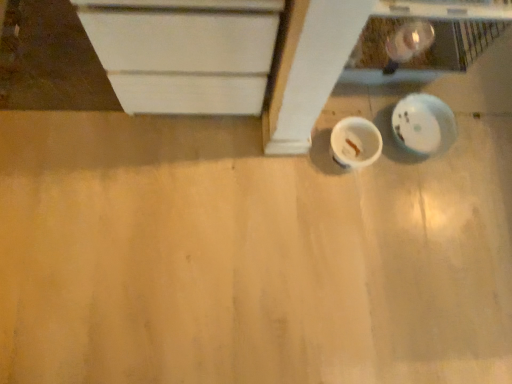
Question: Should I look upward or downward to see white glossy plate at lower right?

Choices:
 (A) up
 (B) down

Answer: (A)

Question: From the image's perspective, is matte white plywood at lower right over white matte cup at center?

Choices:
 (A) yes
 (B) no

Answer: (B)

Question: Does matte white plywood at lower right appear on the right side of white matte cup at center?

Choices:
 (A) yes
 (B) no

Answer: (B)

Question: Is white matte cup at center at the back of matte white plywood at lower right?

Choices:
 (A) no
 (B) yes

Answer: (A)

Question: Would you say matte white plywood at lower right is outside white matte cup at center?

Choices:
 (A) no
 (B) yes

Answer: (B)

Question: Is matte white plywood at lower right placed right next to white matte cup at center?

Choices:
 (A) no
 (B) yes

Answer: (A)

Question: Can you confirm if matte white plywood at lower right is shorter than white matte cup at center?

Choices:
 (A) no
 (B) yes

Answer: (B)

Question: Can white glossy plate at lower right be found inside matte white plywood at lower right?

Choices:
 (A) yes
 (B) no

Answer: (B)

Question: From a real-world perspective, is matte white plywood at lower right beneath white glossy plate at lower right?

Choices:
 (A) yes
 (B) no

Answer: (A)

Question: Is matte white plywood at lower right oriented towards white glossy plate at lower right?

Choices:
 (A) no
 (B) yes

Answer: (A)

Question: Is white glossy plate at lower right at the back of matte white plywood at lower right?

Choices:
 (A) no
 (B) yes

Answer: (A)

Question: Is matte white plywood at lower right at the left side of white glossy plate at lower right?

Choices:
 (A) yes
 (B) no

Answer: (A)

Question: Can you see matte white plywood at lower right touching white glossy plate at lower right?

Choices:
 (A) no
 (B) yes

Answer: (A)

Question: Does white glossy plate at lower right have a larger size compared to white matte cup at center?

Choices:
 (A) yes
 (B) no

Answer: (A)